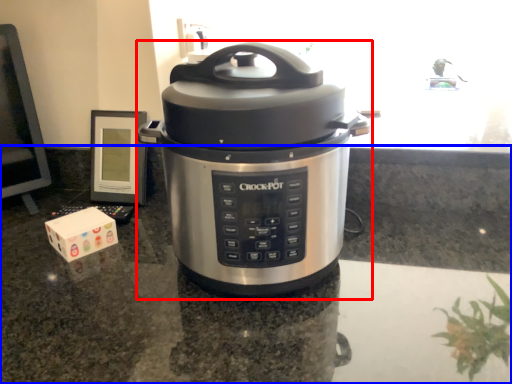
Question: Which point is closer to the camera, slow cooker (highlighted by a red box) or counter top (highlighted by a blue box)?

Choices:
 (A) slow cooker
 (B) counter top

Answer: (B)